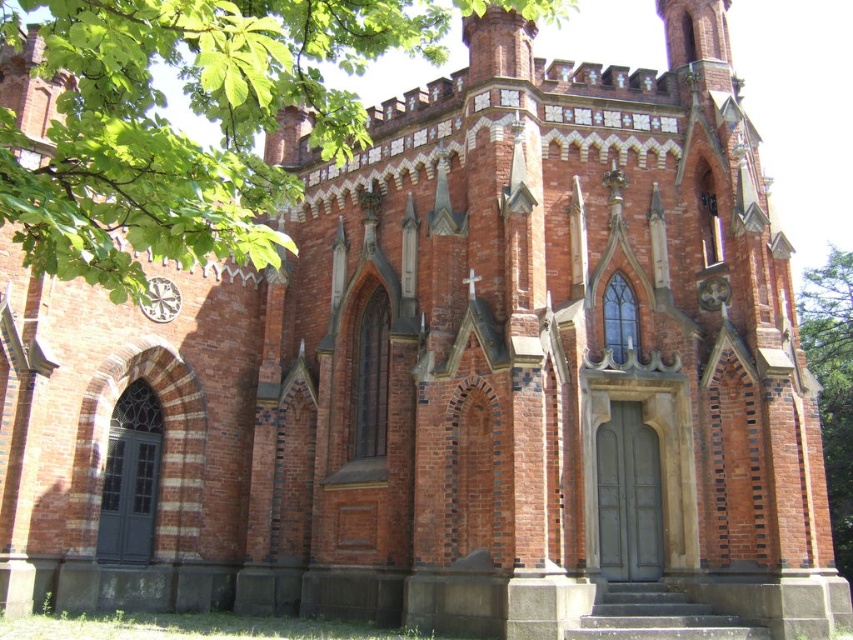
Between green leafy tree at upper left and white ceramic clock at center, which one has less height?

white ceramic clock at center is shorter.

Is point (152, 216) positioned behind point (177, 310)?

No, it is in front of (177, 310).

What do you see at coordinates (194, 113) in the screenshot?
I see `green leafy tree at upper left` at bounding box center [194, 113].

The width and height of the screenshot is (853, 640). Identify the location of green leafy tree at upper left. (194, 113).

Can you confirm if green leafy tree at upper left is positioned below green leafy tree at right?

Incorrect, green leafy tree at upper left is not positioned below green leafy tree at right.

Does green leafy tree at upper left appear over green leafy tree at right?

Correct, green leafy tree at upper left is located above green leafy tree at right.

At what (x,y) coordinates should I click in order to perform the action: click on green leafy tree at upper left. Please return your answer as a coordinate pair (x, y). Image resolution: width=853 pixels, height=640 pixels. Looking at the image, I should click on (194, 113).

Locate an element on the screen. green leafy tree at upper left is located at coordinates (194, 113).

Can you confirm if green leafy tree at right is bigger than white ceramic clock at center?

Yes, green leafy tree at right is bigger than white ceramic clock at center.

Is green leafy tree at right to the right of white ceramic clock at center from the viewer's perspective?

Correct, you'll find green leafy tree at right to the right of white ceramic clock at center.

Is point (837, 257) positioned in front of point (154, 280)?

No, it is behind (154, 280).

Find the location of `green leafy tree at right`. green leafy tree at right is located at coordinates (833, 385).